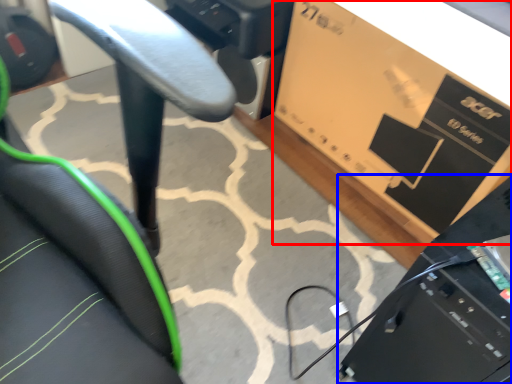
Question: Which object is further to the camera taking this photo, cardboard box (highlighted by a red box) or computer (highlighted by a blue box)?

Choices:
 (A) cardboard box
 (B) computer

Answer: (A)